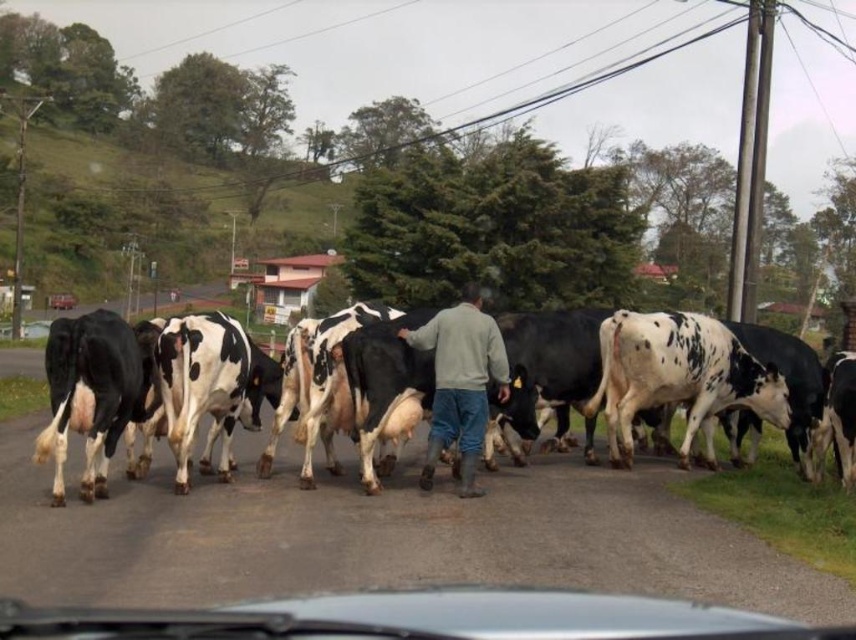
Is transparent glass windshield at center wider than gray fleece jacket at center?

Yes, transparent glass windshield at center is wider than gray fleece jacket at center.

Does transparent glass windshield at center appear on the left side of gray fleece jacket at center?

Indeed, transparent glass windshield at center is positioned on the left side of gray fleece jacket at center.

Identify the location of transparent glass windshield at center. (415, 618).

Consider the image. How far apart are black and white spotted cows at center and metallic silver car at center?

They are 68.87 meters apart.

Where is `black and white spotted cows at center`? Image resolution: width=856 pixels, height=640 pixels. black and white spotted cows at center is located at coordinates (66, 384).

Can you confirm if transparent glass windshield at center is shorter than black and white spotted cows at center?

Correct, transparent glass windshield at center is not as tall as black and white spotted cows at center.

Which is more to the right, transparent glass windshield at center or black and white spotted cows at center?

Result: transparent glass windshield at center

Does point (583, 596) come farther from viewer compared to point (343, 404)?

No, it is in front of (343, 404).

This screenshot has width=856, height=640. Identify the location of transparent glass windshield at center. (415, 618).